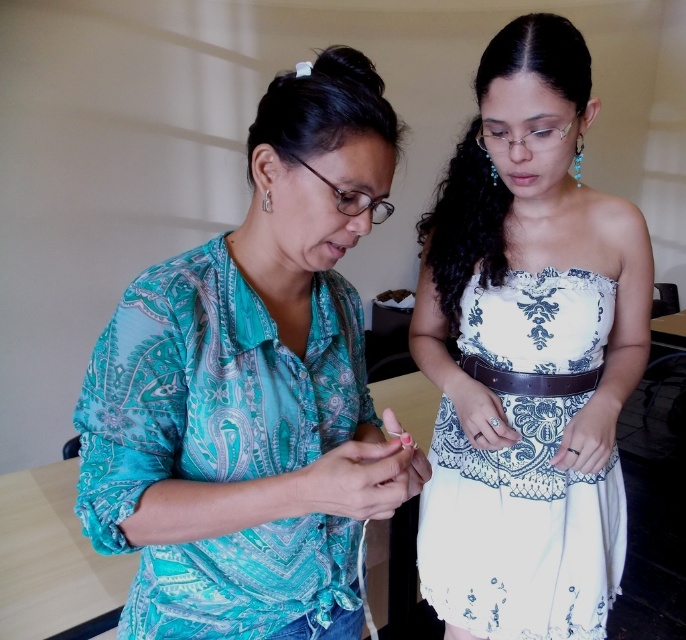
Is point (316, 428) farther from camera compared to point (453, 458)?

No, it is in front of (453, 458).

Can you confirm if teal printed blouse at left is positioned above white lace dress at center?

Correct, teal printed blouse at left is located above white lace dress at center.

Describe the element at coordinates (252, 388) in the screenshot. The width and height of the screenshot is (686, 640). I see `teal printed blouse at left` at that location.

Locate an element on the screen. This screenshot has width=686, height=640. teal printed blouse at left is located at coordinates (252, 388).

Who is higher up, teal printed blouse at left or silver metallic earring at upper left?

Positioned higher is silver metallic earring at upper left.

Who is taller, teal printed blouse at left or silver metallic earring at upper left?

Standing taller between the two is teal printed blouse at left.

This screenshot has height=640, width=686. I want to click on teal printed blouse at left, so click(x=252, y=388).

This screenshot has width=686, height=640. I want to click on white lace dress at center, so click(517, 518).

Image resolution: width=686 pixels, height=640 pixels. Describe the element at coordinates (517, 518) in the screenshot. I see `white lace dress at center` at that location.

Where is `white lace dress at center`? This screenshot has height=640, width=686. white lace dress at center is located at coordinates (517, 518).